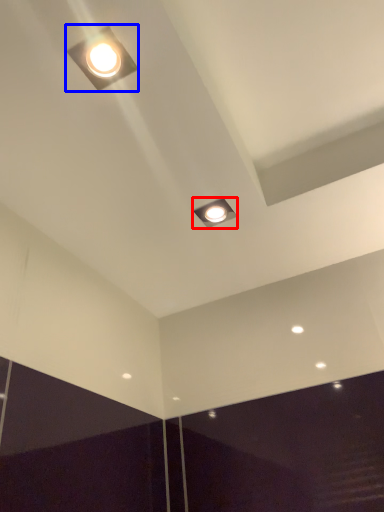
Question: Which point is closer to the camera, lamp (highlighted by a red box) or lamp (highlighted by a blue box)?

Choices:
 (A) lamp
 (B) lamp

Answer: (B)